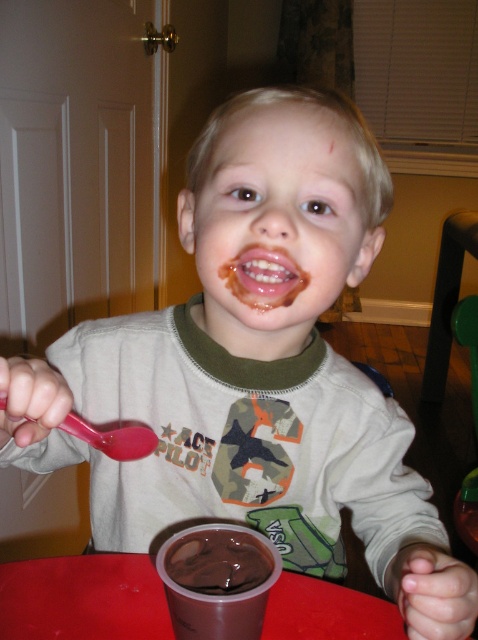
Question: Which of the following is the closest to the observer?

Choices:
 (A) (231, 586)
 (B) (262, 566)
 (C) (275, 285)
 (D) (118, 618)

Answer: (B)

Question: Among these objects, which one is nearest to the camera?

Choices:
 (A) smooth plastic table at center
 (B) glossy chocolate at center

Answer: (B)

Question: Is smooth chocolate face at center below smooth plastic table at center?

Choices:
 (A) yes
 (B) no

Answer: (B)

Question: Which object appears farthest from the camera in this image?

Choices:
 (A) glossy chocolate at center
 (B) chocolate smoothie at lower center
 (C) pink plastic spoon at left
 (D) chocolate matte cup at lower center

Answer: (A)

Question: Does chocolate smoothie at lower center appear on the right side of pink plastic spoon at left?

Choices:
 (A) yes
 (B) no

Answer: (A)

Question: Does smooth chocolate face at center have a larger size compared to chocolate smoothie at lower center?

Choices:
 (A) yes
 (B) no

Answer: (A)